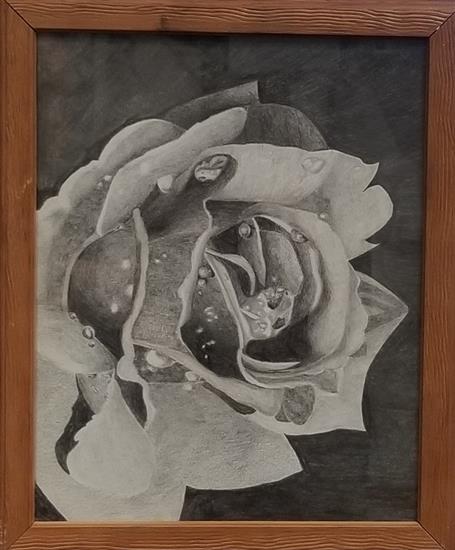
At what (x,y) coordinates should I click in order to perform the action: click on top right corner of picture frame. Please return your answer as a coordinate pair (x, y). This screenshot has width=455, height=550. Looking at the image, I should click on (450, 0).